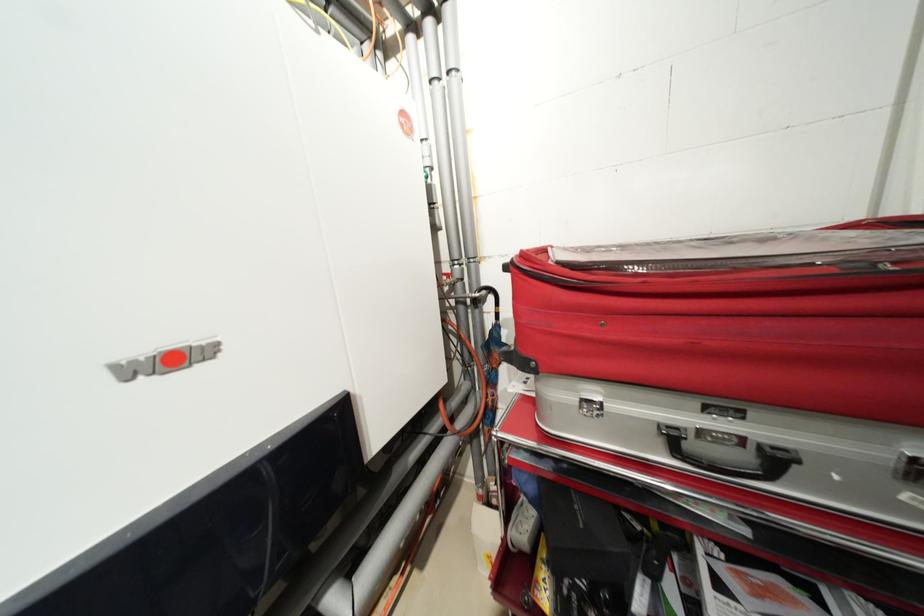
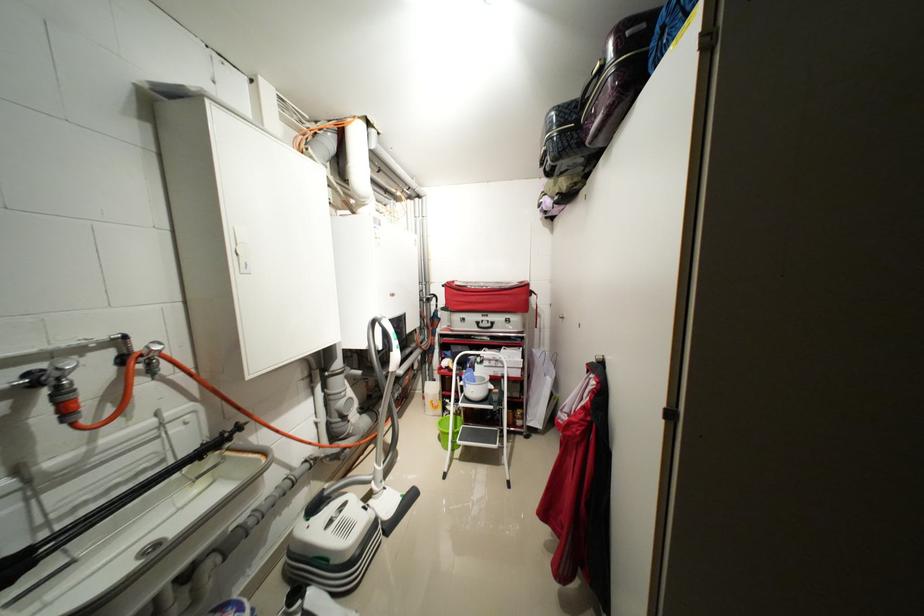
Locate, in the second image, the point that corresponds to point (530, 256) in the first image.

(455, 284)